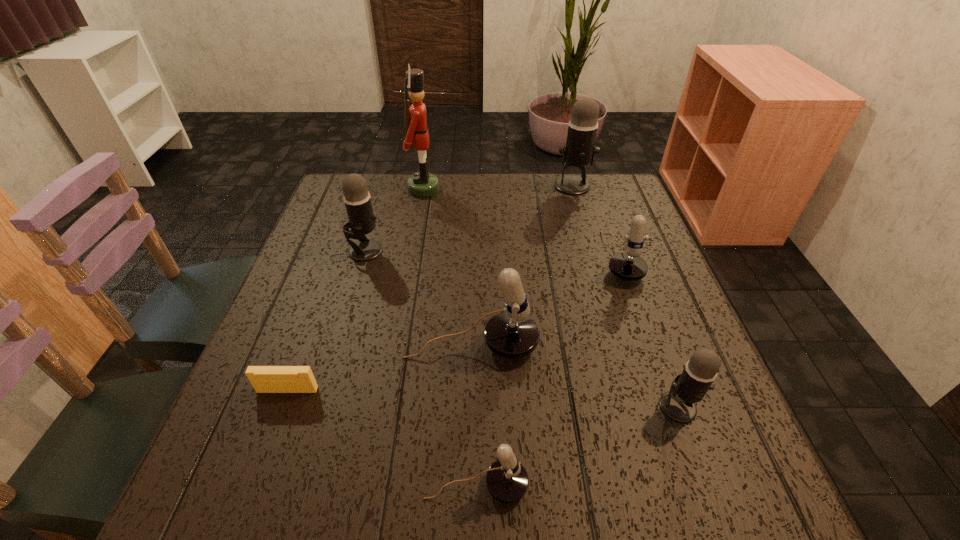
The width and height of the screenshot is (960, 540). Identify the location of free space that is in between the tallest microphone and the second nearest white microphone. (522, 265).

Identify the location of free area in between the nutcracker and the nearest white microphone. The width and height of the screenshot is (960, 540). (450, 337).

Identify the location of vacant area that lies between the nearest white microphone and the second nearest microphone. (577, 446).

The height and width of the screenshot is (540, 960). Find the location of `vacant area that lies between the second biggest white microphone and the second biggest gray microphone`. vacant area that lies between the second biggest white microphone and the second biggest gray microphone is located at coordinates (492, 254).

Locate an element on the screen. This screenshot has height=540, width=960. the seventh closest object to the fourth nearest object is located at coordinates (579, 151).

Image resolution: width=960 pixels, height=540 pixels. Identify the location of object that is the sixth nearest to the fourth nearest object. (421, 184).

Identify which microphone is located as the fourth nearest to the farthest white microphone. Please provide its 2D coordinates. Your answer should be formatted as a tuple, i.e. [(x, y)], where the tuple contains the x and y coordinates of a point satisfying the conditions above.

[(507, 481)]

The height and width of the screenshot is (540, 960). I want to click on microphone that is the closest to the farthest gray microphone, so click(629, 266).

Locate an element on the screen. The height and width of the screenshot is (540, 960). gray microphone that is the second closest to the beige videotape is located at coordinates (689, 387).

Identify the location of gray microphone that is the closest one to the smallest white microphone. (689, 387).